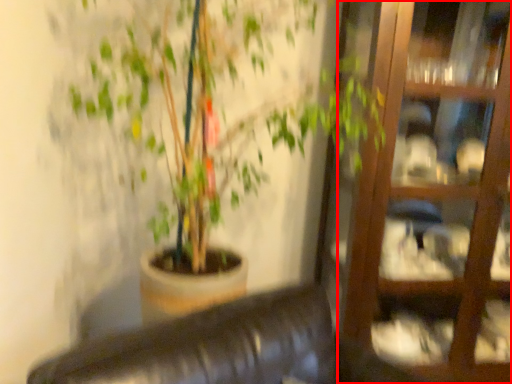
Question: Considering the relative positions of glass door (annotated by the red box) and houseplant in the image provided, where is glass door (annotated by the red box) located with respect to the staircase?

Choices:
 (A) left
 (B) right

Answer: (B)